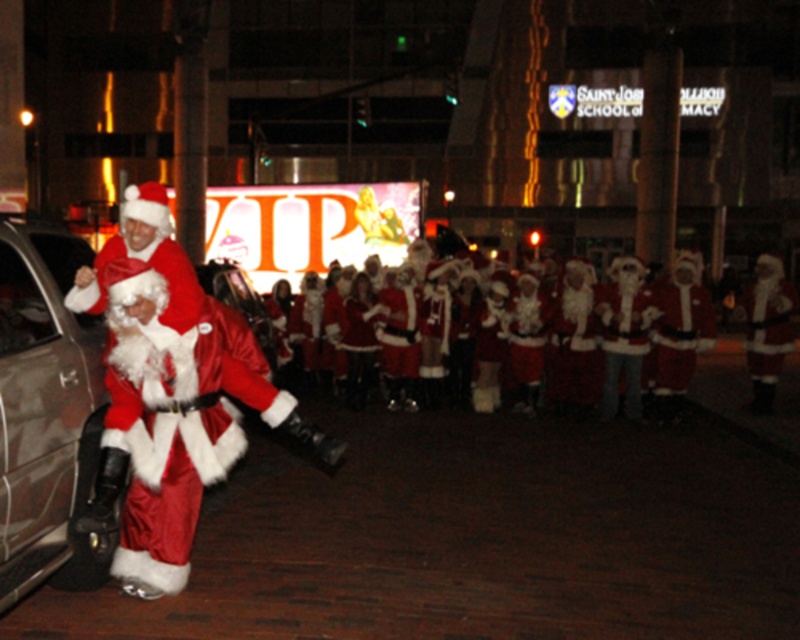
You are a photographer at the event and want to capture a closeup of the velvet red santa at left. According to the coordinates provided, where exactly should you aim your camera?

The velvet red santa at left is located at coordinates point [168,397].

You are a photographer trying to capture a clear shot of the velvet red santa at left and the metallic gray car at left. Based on their positions, which one is closer to the camera?

Result: The velvet red santa at left is positioned over the metallic gray car at left, so the velvet red santa at left is closer to the camera.

You are standing at point (158,502) and want to take a photo of the Santas in the background. The camera you have can focus on subjects up to 5 meters away. Will the camera be able to capture the Santas clearly?

The distance between point (158,502) and the camera is 5.18 meters, which exceeds the camera maximum focus range of 5 meters. Therefore, the camera will not be able to capture the Santas clearly.